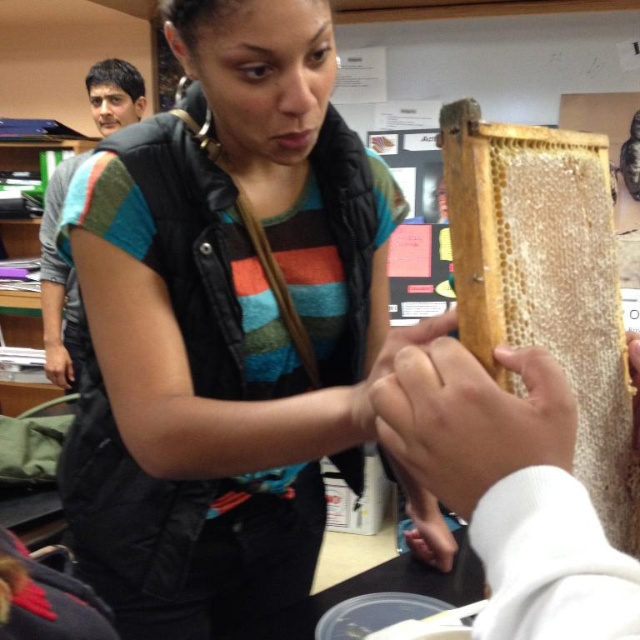
You are an observer in the classroom and want to know which object is wider between the matte black vest at center and the natural honeycomb at upper right. Can you tell me which one is wider?

The matte black vest at center is wider than the natural honeycomb at upper right according to the description.

You are a student in the classroom and need to locate the natural honeycomb at upper right. According to the coordinates given, where exactly is it positioned?

The natural honeycomb at upper right is positioned at coordinates point (x=545, y=280).